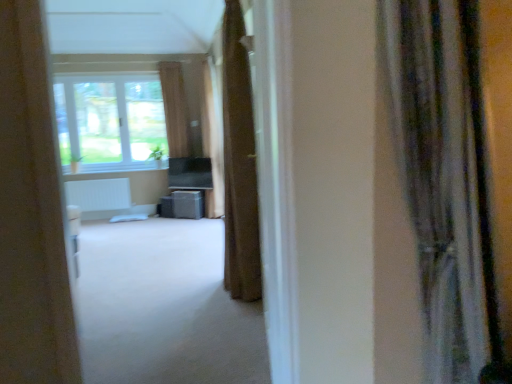
Question: Is brown fabric curtain at center, which is the 2th curtain from left to right, surrounded by matte gray speaker at center?

Choices:
 (A) no
 (B) yes

Answer: (A)

Question: From a real-world perspective, is matte gray speaker at center under brown fabric curtain at center, which appears as the 2th curtain when viewed from the back?

Choices:
 (A) no
 (B) yes

Answer: (B)

Question: From the image's perspective, is matte gray speaker at center located above brown fabric curtain at center, which appears as the 2th curtain when viewed from the back?

Choices:
 (A) yes
 (B) no

Answer: (B)

Question: Is matte gray speaker at center positioned beyond the bounds of brown fabric curtain at center, which appears as the 2th curtain when viewed from the back?

Choices:
 (A) yes
 (B) no

Answer: (A)

Question: Can you confirm if matte gray speaker at center is taller than brown fabric curtain at center, which is the 2th curtain from left to right?

Choices:
 (A) no
 (B) yes

Answer: (A)

Question: Does matte gray speaker at center come behind brown fabric curtain at center, placed as the third curtain when sorted from front to back?

Choices:
 (A) no
 (B) yes

Answer: (B)

Question: From a real-world perspective, is brown fabric curtain at center, the 3th curtain viewed from the left, positioned over brown fabric curtain at center, arranged as the first curtain when viewed from the back, based on gravity?

Choices:
 (A) no
 (B) yes

Answer: (A)

Question: Is brown fabric curtain at center, which is the 4th curtain from right to left, a part of brown fabric curtain at center, placed as the second curtain when sorted from front to back?

Choices:
 (A) yes
 (B) no

Answer: (B)

Question: Is brown fabric curtain at center, the 3th curtain viewed from the left, outside of brown fabric curtain at center, which appears as the 1th curtain when viewed from the left?

Choices:
 (A) no
 (B) yes

Answer: (B)

Question: Is brown fabric curtain at center, the 3th curtain from the back, positioned behind brown fabric curtain at center, which appears as the 1th curtain when viewed from the left?

Choices:
 (A) yes
 (B) no

Answer: (B)

Question: Is brown fabric curtain at center, which is the second curtain from right to left, turned away from brown fabric curtain at center, which appears as the fourth curtain when viewed from the front?

Choices:
 (A) yes
 (B) no

Answer: (B)

Question: Could you tell me if brown fabric curtain at center, the 3th curtain from the back, is turned towards brown fabric curtain at center, which appears as the fourth curtain when viewed from the front?

Choices:
 (A) no
 (B) yes

Answer: (A)

Question: Can you confirm if silky gray curtain at right, positioned as the 4th curtain in back-to-front order, is shorter than matte gray speaker at center?

Choices:
 (A) no
 (B) yes

Answer: (A)